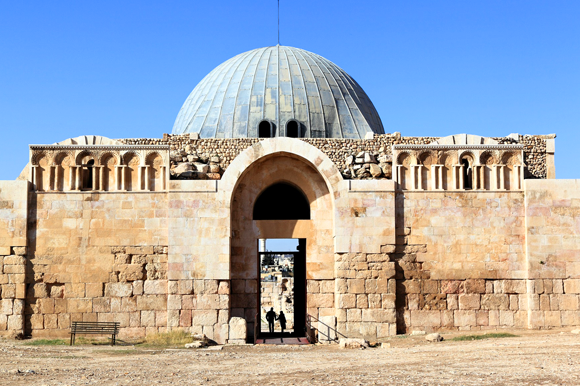
In order to click on legs of the bench in this screenshot , I will do `click(111, 342)`, `click(71, 341)`.